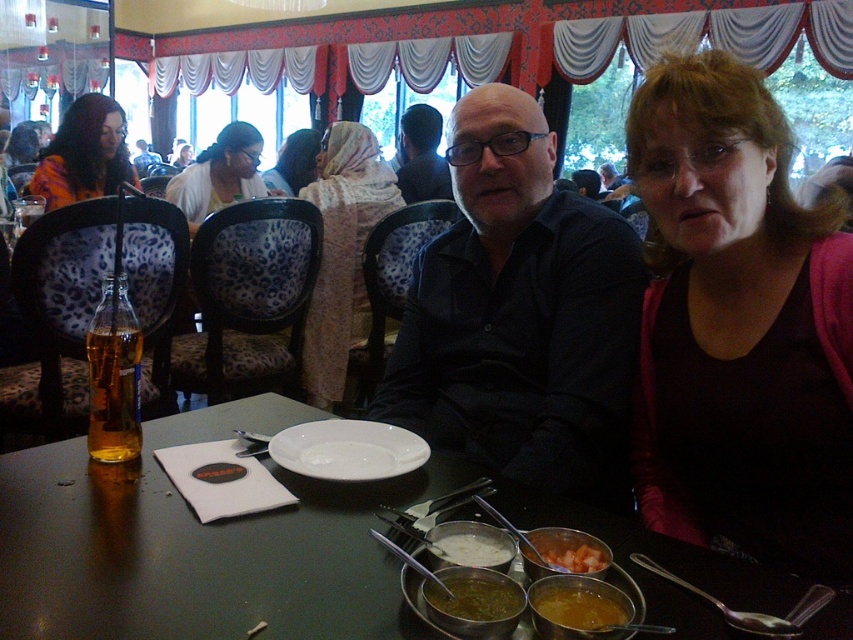
Question: Which of the following is the closest to the observer?

Choices:
 (A) (416, 150)
 (B) (769, 209)
 (C) (607, 576)

Answer: (C)

Question: Considering the real-world distances, which object is closest to the translucent amber liquid at table left?

Choices:
 (A) black matte shirt at center
 (B) dark blue shirt at center
 (C) white ceramic plate at center
 (D) matte beige scarf at upper center

Answer: (C)

Question: Can you confirm if dark red sweater at right is positioned to the right of translucent amber liquid at table left?

Choices:
 (A) yes
 (B) no

Answer: (A)

Question: Does yellowish-brown paste at lower center appear under matte black shirt at center?

Choices:
 (A) no
 (B) yes

Answer: (B)

Question: Estimate the real-world distances between objects in this image. Which object is farther from the orange printed shirt at upper left?

Choices:
 (A) matte black shirt at center
 (B) shiny black table at center
 (C) white ceramic plate at center
 (D) matte beige scarf at upper center

Answer: (A)

Question: Can you confirm if dark blue shirt at center is positioned below white creamy sauce at center?

Choices:
 (A) yes
 (B) no

Answer: (B)